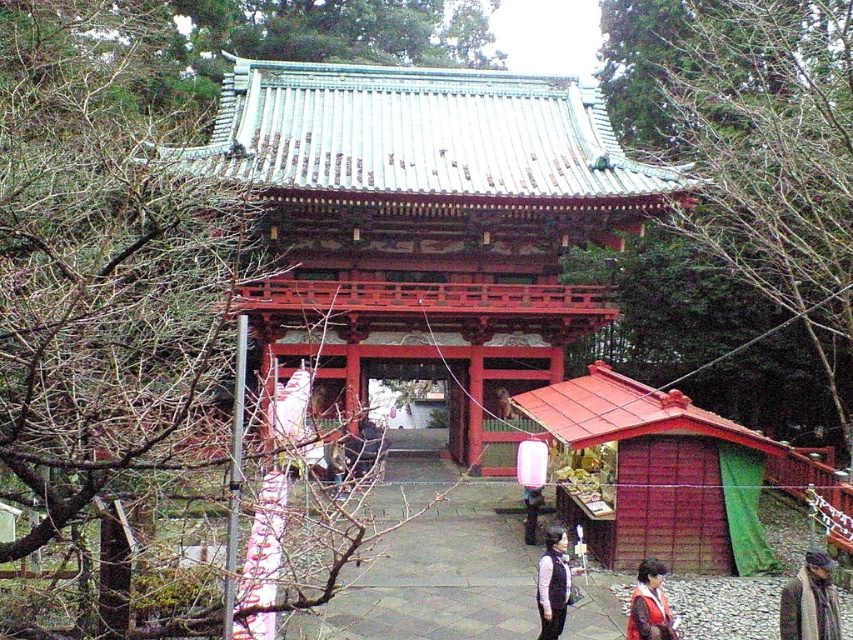
Is shiny red wooden gate at center further to the viewer compared to red velvet coat at lower right?

Yes, shiny red wooden gate at center is behind red velvet coat at lower right.

Measure the distance from shiny red wooden gate at center to red velvet coat at lower right.

They are 14.15 meters apart.

Which is behind, point (315, 371) or point (642, 609)?

The point (315, 371) is behind.

Where is `shiny red wooden gate at center`? shiny red wooden gate at center is located at coordinates (428, 227).

Who is taller, smooth stone path at center or matte black vest at center?

Standing taller between the two is matte black vest at center.

Can you confirm if smooth stone path at center is positioned above matte black vest at center?

No, smooth stone path at center is not above matte black vest at center.

Which is behind, point (339, 628) or point (544, 609)?

Positioned behind is point (339, 628).

At what (x,y) coordinates should I click in order to perform the action: click on smooth stone path at center. Please return your answer as a coordinate pair (x, y). Looking at the image, I should click on (439, 579).

Does smooth stone path at center have a lesser width compared to red velvet coat at lower right?

In fact, smooth stone path at center might be wider than red velvet coat at lower right.

Between smooth stone path at center and red velvet coat at lower right, which one is positioned lower?

smooth stone path at center is lower down.

Where is `smooth stone path at center`? The height and width of the screenshot is (640, 853). smooth stone path at center is located at coordinates (439, 579).